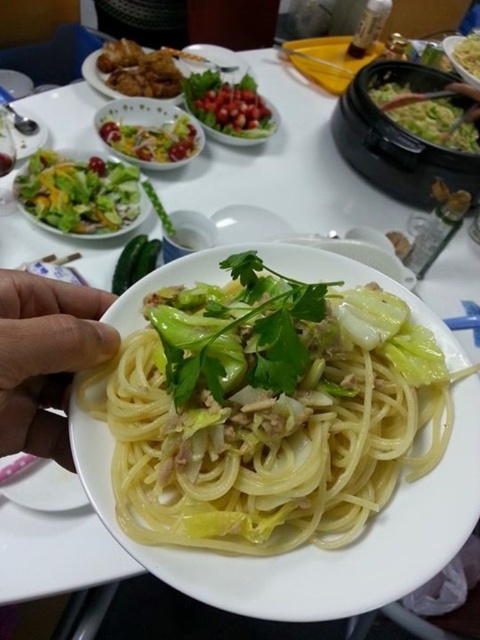
Question: Among these objects, which one is farthest from the camera?

Choices:
 (A) green smooth skin at center
 (B) white glossy pasta at center
 (C) green leafy vegetable at upper right
 (D) shiny green salad at upper left

Answer: (C)

Question: From the image, what is the correct spatial relationship of green smooth skin at center in relation to yellow matte noodles at center?

Choices:
 (A) below
 (B) above

Answer: (A)

Question: Can you confirm if fresh green salad at left is wider than yellow matte noodles at center?

Choices:
 (A) yes
 (B) no

Answer: (A)

Question: Can you confirm if green leafy vegetable at upper center is wider than matte plastic fork at upper center?

Choices:
 (A) yes
 (B) no

Answer: (A)

Question: Which object is the closest to the green smooth skin at center?

Choices:
 (A) fresh green salad at left
 (B) white glossy pasta at center
 (C) matte plastic fork at upper center
 (D) shiny green salad at upper left

Answer: (A)

Question: Estimate the real-world distances between objects in this image. Which object is closer to the green leafy vegetable at upper right?

Choices:
 (A) green smooth skin at center
 (B) matte plastic fork at upper center

Answer: (B)